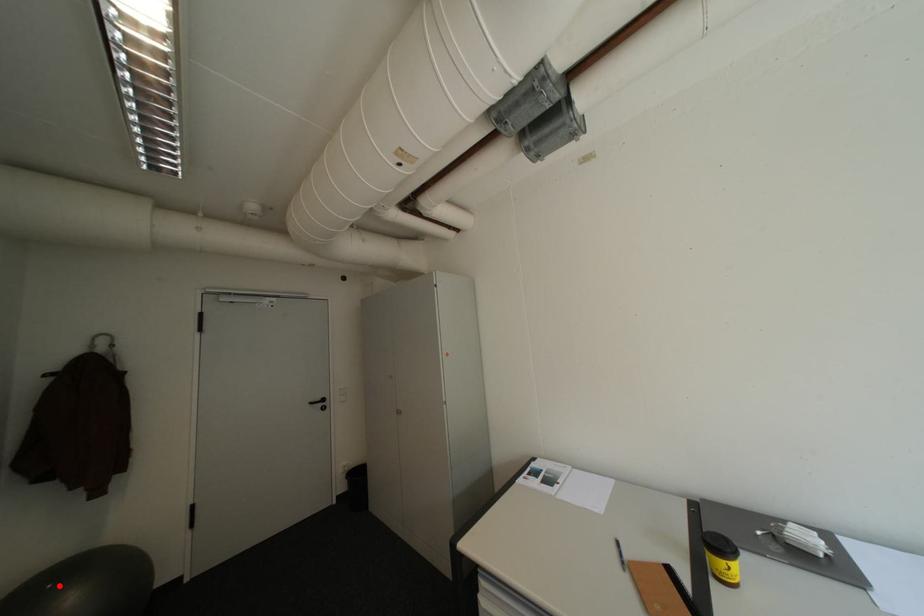
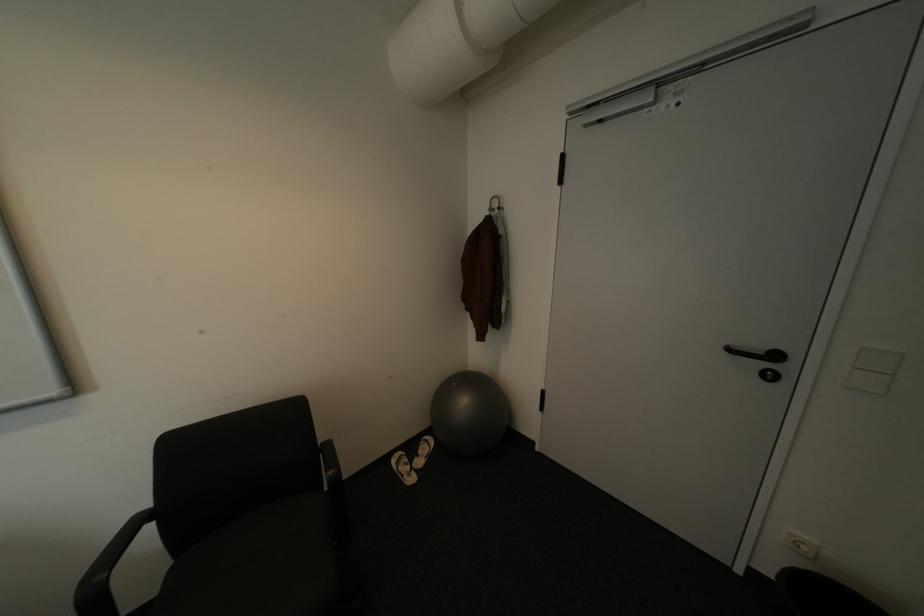
The point at the highlighted location is marked in the first image. Where is the corresponding point in the second image?

(464, 384)